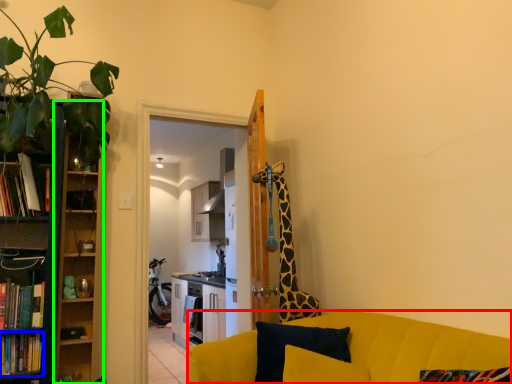
Question: Considering the real-world distances, which object is farthest from studio couch (highlighted by a red box)? book (highlighted by a blue box) or cabinet (highlighted by a green box)?

Choices:
 (A) book
 (B) cabinet

Answer: (A)